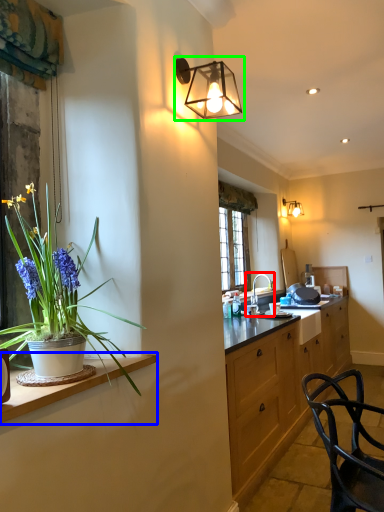
Question: Considering the real-world distances, which object is farthest from sink (highlighted by a red box)? countertop (highlighted by a blue box) or lamp (highlighted by a green box)?

Choices:
 (A) countertop
 (B) lamp

Answer: (A)